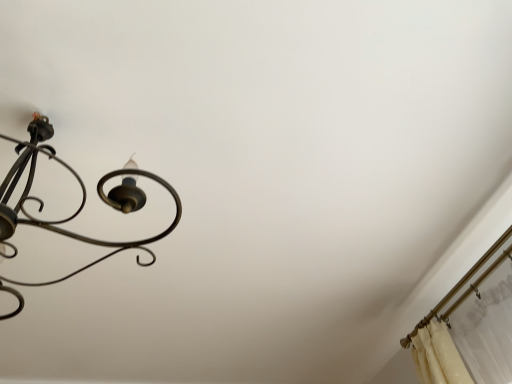
Identify the location of matte black chandelier at upper left. (77, 209).

Describe the element at coordinates (77, 209) in the screenshot. I see `matte black chandelier at upper left` at that location.

Image resolution: width=512 pixels, height=384 pixels. In order to click on matte black chandelier at upper left in this screenshot , I will do `click(77, 209)`.